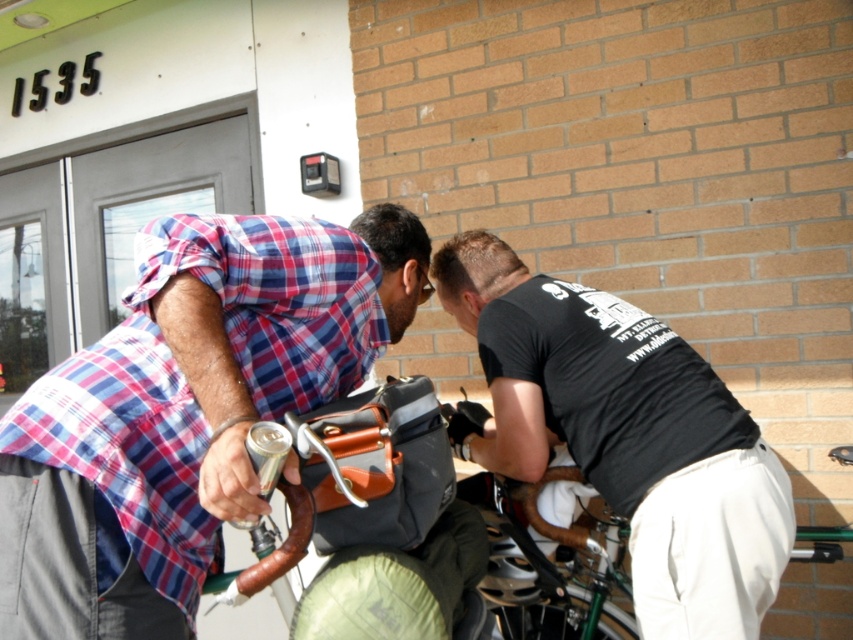
You are a photographer trying to capture a photo of the scene. The black matte shirt at center and the green metallic bicycle at lower center are both in the frame. Which object should you focus on if you want to ensure the larger one is in sharp focus?

The black matte shirt at center is bigger than the green metallic bicycle at lower center, so you should focus on the black matte shirt at center to ensure it is in sharp focus.

You are standing in front of the brick building and want to walk towards the two points marked in the image. Which point, point (305,310) or point (723,451), would you reach first?

Point (305,310) is closer to the viewer than point (723,451), so you would reach point (305,310) first.